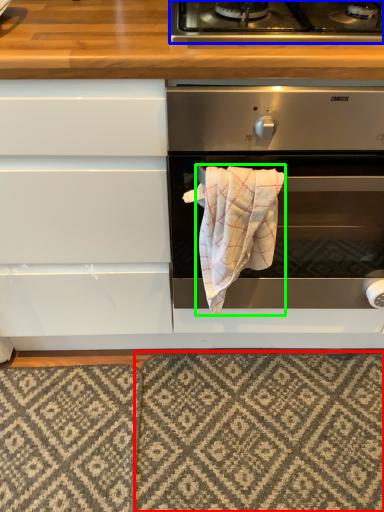
Question: Which object is positioned farthest from mat (highlighted by a red box)? Select from gas stove (highlighted by a blue box) and bath towel (highlighted by a green box).

Choices:
 (A) gas stove
 (B) bath towel

Answer: (A)